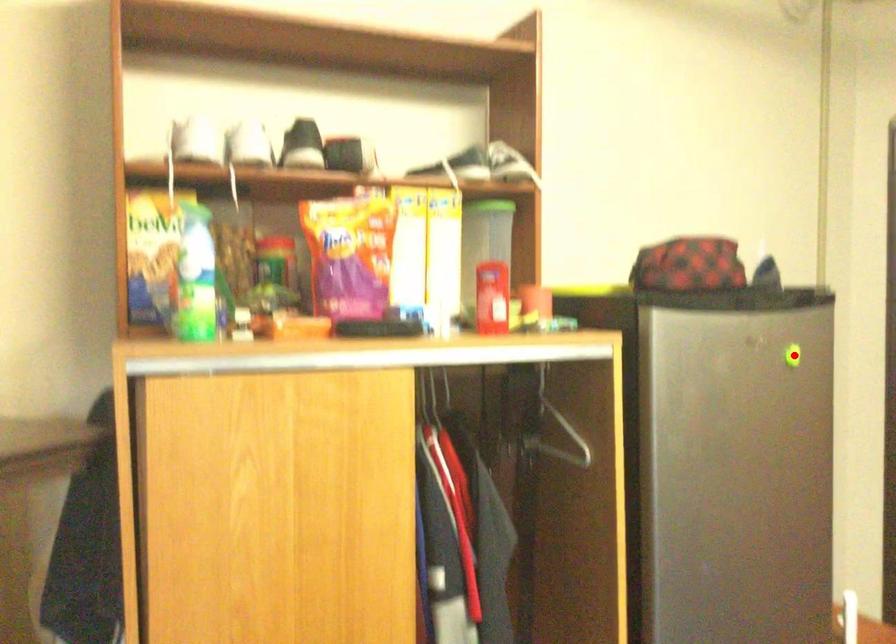
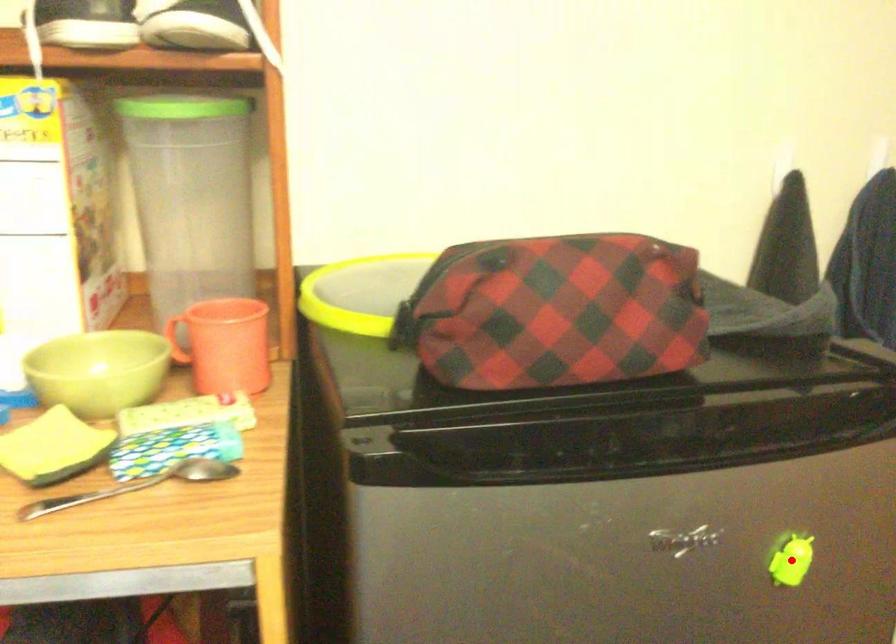
I am providing you with two images of the same scene from different viewpoints. A red point is marked on the first image and another point is marked on the second image. Are the points marked in image1 and image2 representing the same 3D position?

Yes